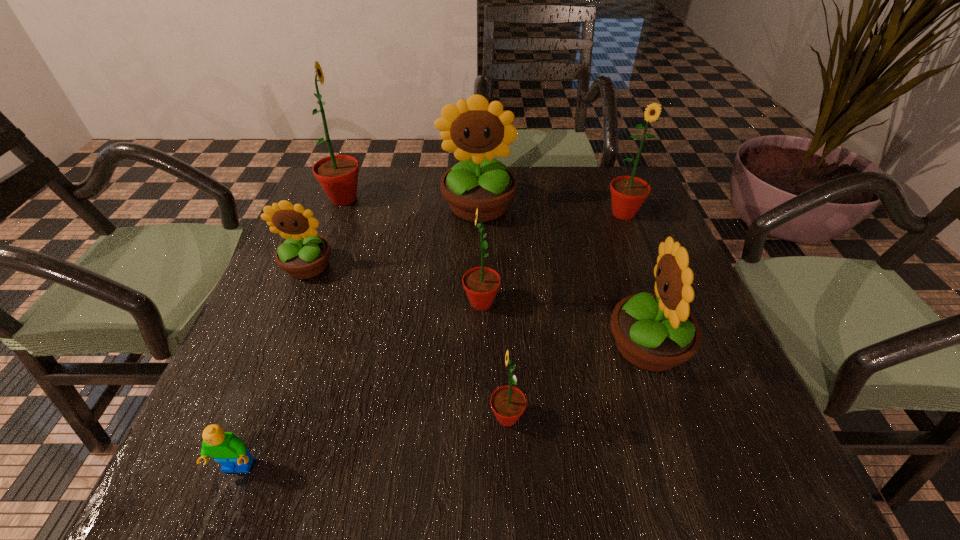
Find the location of a particular element. the tallest object is located at coordinates (338, 174).

The width and height of the screenshot is (960, 540). Find the location of `the tallest sunflower`. the tallest sunflower is located at coordinates (338, 174).

Identify the location of the farthest yellow sunflower. Image resolution: width=960 pixels, height=540 pixels. (475, 131).

Locate an element on the screen. the biggest yellow sunflower is located at coordinates (475, 131).

Find the location of a particular element. This screenshot has height=540, width=960. the rightmost green sunflower is located at coordinates (628, 193).

The width and height of the screenshot is (960, 540). Find the location of `the second smallest yellow sunflower`. the second smallest yellow sunflower is located at coordinates (655, 332).

I want to click on the rightmost yellow sunflower, so click(x=655, y=332).

At what (x,y) coordinates should I click in order to perform the action: click on the second smallest green sunflower. Please return your answer as a coordinate pair (x, y). Looking at the image, I should click on (481, 284).

Find the location of `the fourth nearest sunflower`. the fourth nearest sunflower is located at coordinates (304, 254).

Locate an element on the screen. The image size is (960, 540). the smallest yellow sunflower is located at coordinates [x=304, y=254].